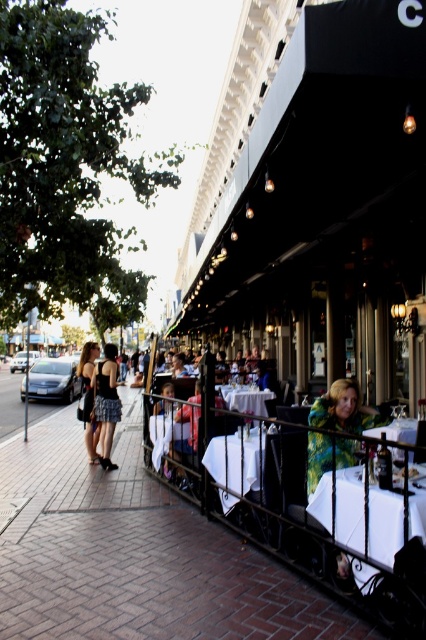
Between brick pavement at lower center and white glossy table at center, which one appears on the left side from the viewer's perspective?

From the viewer's perspective, brick pavement at lower center appears more on the left side.

Does brick pavement at lower center have a larger size compared to white glossy table at center?

Indeed, brick pavement at lower center has a larger size compared to white glossy table at center.

Where is `brick pavement at lower center`? This screenshot has height=640, width=426. brick pavement at lower center is located at coordinates (134, 554).

Find the location of a particular element. The height and width of the screenshot is (640, 426). brick pavement at lower center is located at coordinates (134, 554).

Is brick pavement at lower center positioned in front of white linen table at lower right?

No, it is behind white linen table at lower right.

Is brick pavement at lower center to the right of white linen table at lower right from the viewer's perspective?

No, brick pavement at lower center is not to the right of white linen table at lower right.

Which is behind, point (155, 627) or point (417, 497)?

The point (155, 627) is more distant.

This screenshot has height=640, width=426. In order to click on brick pavement at lower center in this screenshot , I will do `click(134, 554)`.

Is white glossy table at center above white glossy table at lower right?

Actually, white glossy table at center is below white glossy table at lower right.

Is point (235, 492) positioned behind point (420, 458)?

Yes, point (235, 492) is farther from viewer.

Image resolution: width=426 pixels, height=640 pixels. What do you see at coordinates (236, 464) in the screenshot?
I see `white glossy table at center` at bounding box center [236, 464].

Identify the location of white glossy table at center. This screenshot has height=640, width=426. (236, 464).